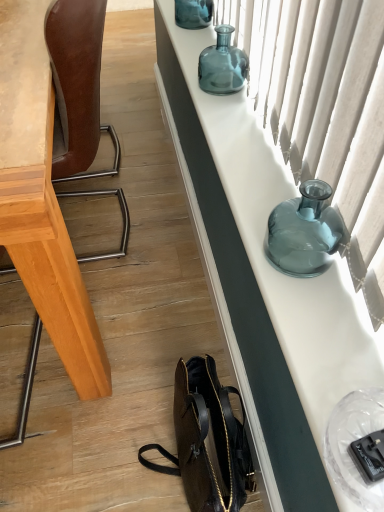
The height and width of the screenshot is (512, 384). I want to click on space that is in front of translucent glass vase at upper center, the second bottle in the back-to-front sequence, so click(x=232, y=113).